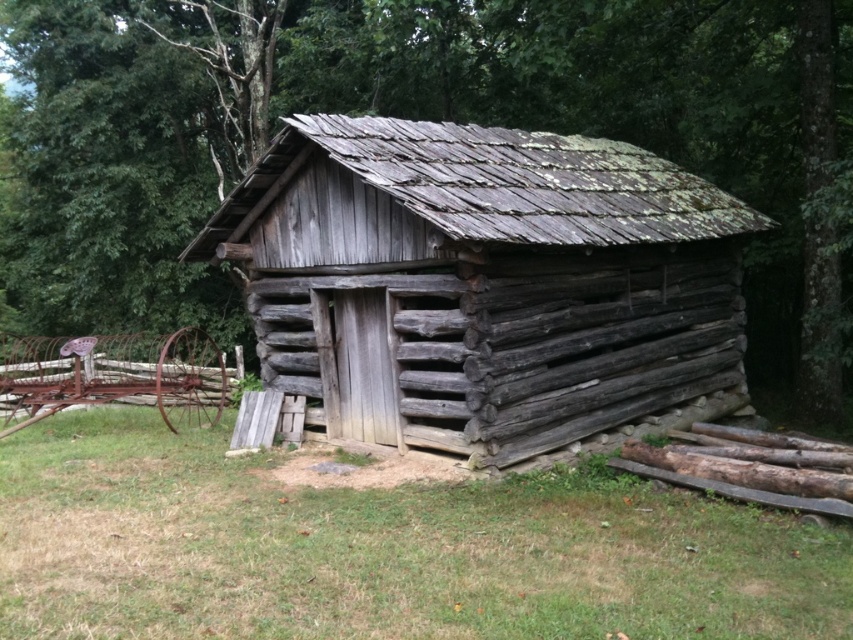
Looking at this image, measure the distance between green mossy tree at upper center and weathered wood log cabin at center.

A distance of 9.88 meters exists between green mossy tree at upper center and weathered wood log cabin at center.

In the scene shown: Does green mossy tree at upper center have a larger size compared to weathered wood log cabin at center?

Yes.

Between point (831, 333) and point (276, 365), which one is positioned in front?

Positioned in front is point (276, 365).

In order to click on green mossy tree at upper center in this screenshot , I will do `click(634, 120)`.

Between green grass at lower center and rusty metal fence at left, which one has less height?

With less height is green grass at lower center.

Is point (230, 547) less distant than point (96, 364)?

Yes, point (230, 547) is closer to viewer.

Is point (422, 493) positioned before point (100, 369)?

Yes, point (422, 493) is closer to viewer.

Image resolution: width=853 pixels, height=640 pixels. I want to click on green grass at lower center, so click(383, 548).

Between green mossy tree at upper center and rusty metal fence at left, which one has more height?

green mossy tree at upper center

Between point (234, 273) and point (71, 388), which one is positioned in front?

Point (71, 388) is more forward.

What are the coordinates of `green mossy tree at upper center` in the screenshot? It's located at (634, 120).

Identify the location of green mossy tree at upper center. (634, 120).